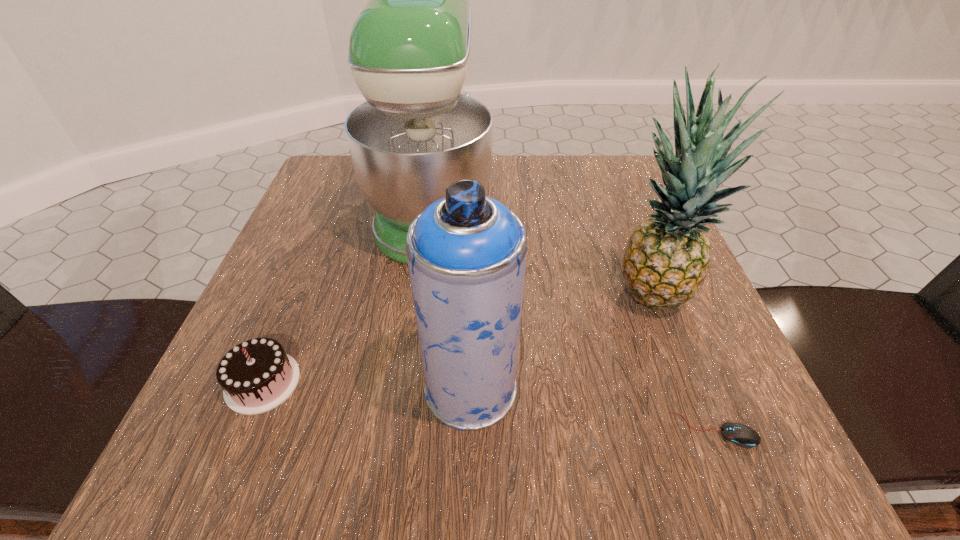
At what (x,y) coordinates should I click in order to perform the action: click on empty space between the fourth tallest object and the aerosol can. Please return your answer as a coordinate pair (x, y). Looking at the image, I should click on (367, 386).

Locate an element on the screen. Image resolution: width=960 pixels, height=540 pixels. free spot between the mixer and the shortest object is located at coordinates (574, 318).

The height and width of the screenshot is (540, 960). I want to click on free spot between the mixer and the pineapple, so click(x=540, y=251).

Point out which object is positioned as the third nearest to the aerosol can. Please provide its 2D coordinates. Your answer should be formatted as a tuple, i.e. [(x, y)], where the tuple contains the x and y coordinates of a point satisfying the conditions above.

[(257, 375)]

Locate which object is the second closest to the mixer. Please provide its 2D coordinates. Your answer should be formatted as a tuple, i.e. [(x, y)], where the tuple contains the x and y coordinates of a point satisfying the conditions above.

[(257, 375)]

Locate an element on the screen. Image resolution: width=960 pixels, height=540 pixels. vacant position in the image that satisfies the following two spatial constraints: 1. on the controls of the mixer; 2. on the right side of the aerosol can is located at coordinates (409, 388).

You are a GUI agent. You are given a task and a screenshot of the screen. Output one action in this format:
    pyautogui.click(x=<x>, y=<y>)
    Task: Click on the free space that satisfies the following two spatial constraints: 1. on the controls of the mixer; 2. on the right side of the aerosol can
    The height and width of the screenshot is (540, 960).
    Given the screenshot: What is the action you would take?
    409,388

Locate an element on the screen. vacant space that satisfies the following two spatial constraints: 1. on the controls of the pineapple; 2. on the left side of the mixer is located at coordinates (421, 295).

Where is `vacant space that satisfies the following two spatial constraints: 1. on the controls of the pineapple; 2. on the right side of the mixer`? This screenshot has width=960, height=540. vacant space that satisfies the following two spatial constraints: 1. on the controls of the pineapple; 2. on the right side of the mixer is located at coordinates (421, 295).

Where is `free space that satisfies the following two spatial constraints: 1. on the back side of the mouse; 2. on the controls of the mixer`? Image resolution: width=960 pixels, height=540 pixels. free space that satisfies the following two spatial constraints: 1. on the back side of the mouse; 2. on the controls of the mixer is located at coordinates (624, 206).